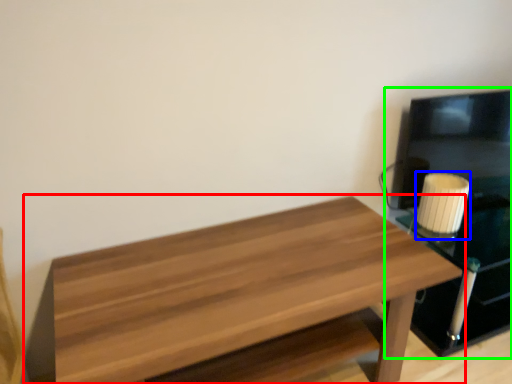
Question: Considering the real-world distances, which object is closest to table (highlighted by a red box)? candle holder (highlighted by a blue box) or entertainment center (highlighted by a green box).

Choices:
 (A) candle holder
 (B) entertainment center

Answer: (A)